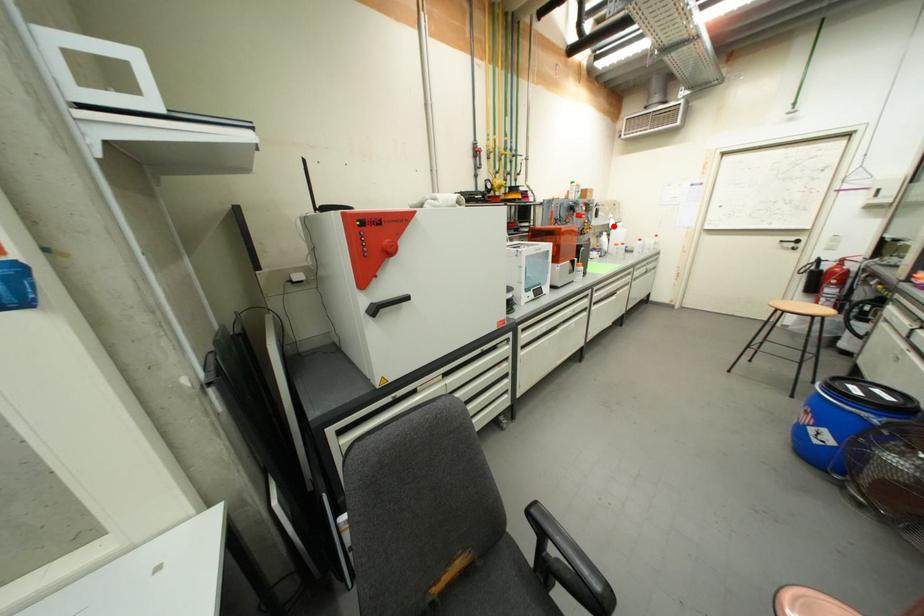
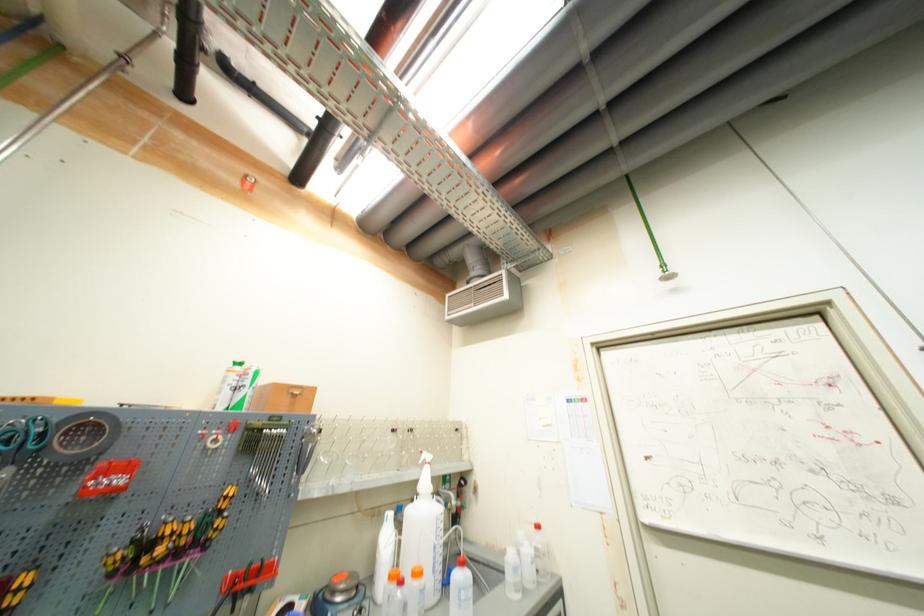
Find the pixel in the second image that matches the highlighted location in the first image.

(421, 484)